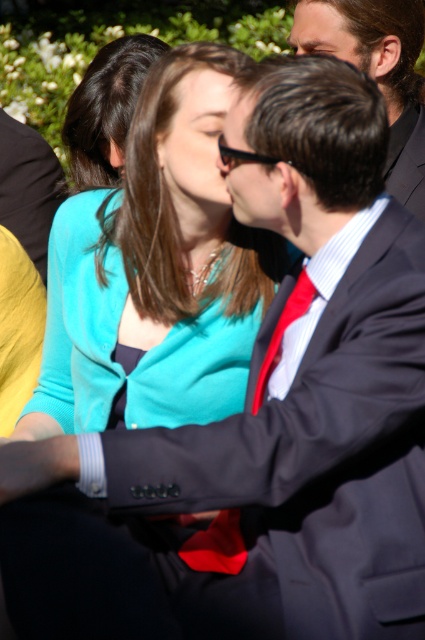
You are a photographer trying to position a spotlight for a scene similar to the one described. The spotlight needs to be placed at coordinates that are exactly 0.1 units to the right and 0.05 units above the matte black suit at center. What are the coordinates where you should place the spotlight?

The coordinates for the spotlight should be calculated by adding 0.1 to the x and 0.05 to the y of the matte black suit at center. The original coordinates are (28, 186). Adding 0.1 to the x gives 0.392 and adding 0.05 to the y gives 0.118. Therefore, the spotlight should be placed at coordinates (50, 250).

You are a photographer adjusting the lighting for a portrait. You notice a point at coordinates (28, 186) on the image. According to the scene description, what object is located at this point?

The point at coordinates (28, 186) marks the matte black suit at center.